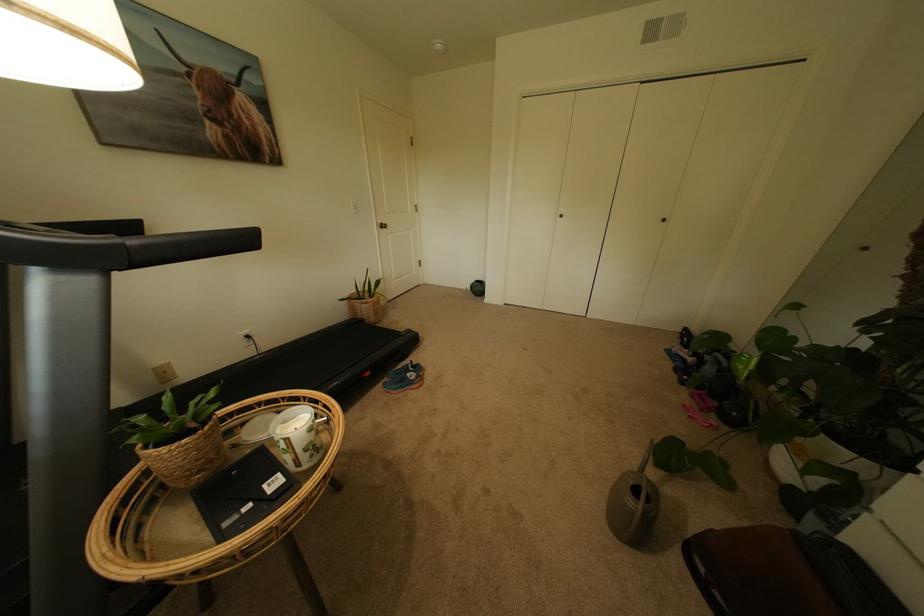
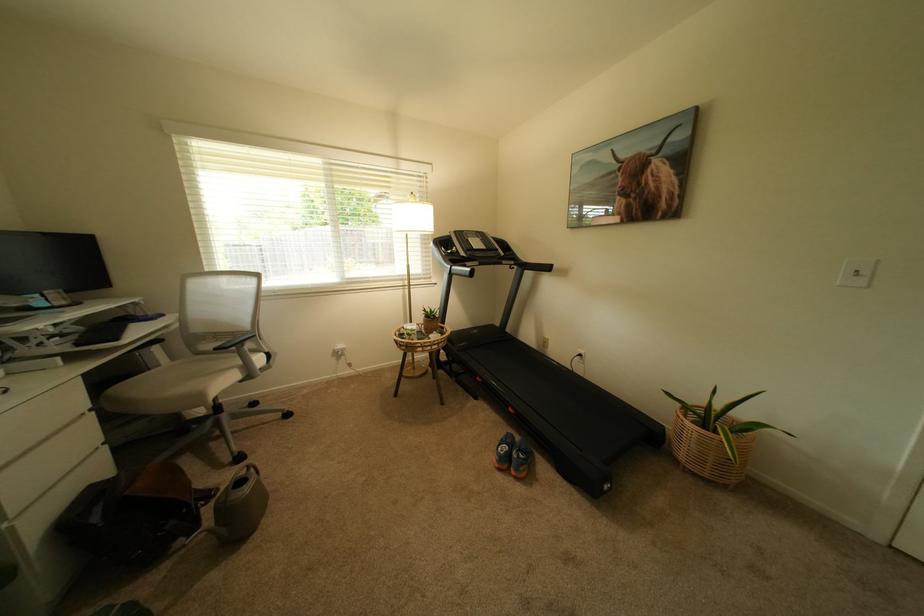
In the second image, find the point that corresponds to (x=382, y=314) in the first image.

(695, 448)